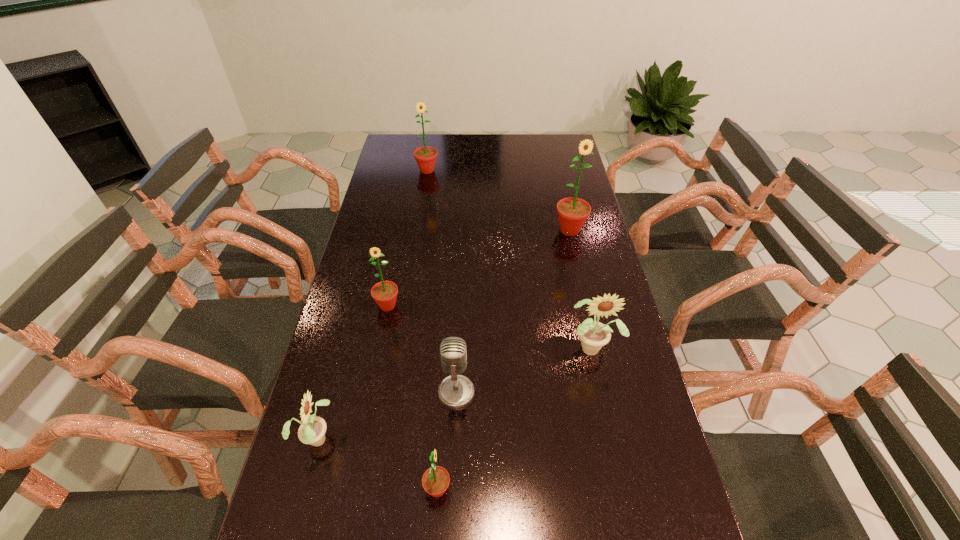
This screenshot has width=960, height=540. What are the coordinates of `vacant region located 0.090m on the face of the nearest sunflower` in the screenshot? It's located at [x=492, y=489].

Locate an element on the screen. Image resolution: width=960 pixels, height=540 pixels. vacant position at the far edge of the desktop is located at coordinates (497, 134).

Locate an element on the screen. The width and height of the screenshot is (960, 540). blank space at the left edge is located at coordinates (365, 291).

The image size is (960, 540). In order to click on vacant space at the far left corner of the desktop in this screenshot , I will do `click(390, 148)`.

Locate an element on the screen. Image resolution: width=960 pixels, height=540 pixels. free point between the biggest green sunflower and the gray microphone is located at coordinates 513,311.

Where is `vacant region between the third biggest green sunflower and the second nearest sunflower`? This screenshot has width=960, height=540. vacant region between the third biggest green sunflower and the second nearest sunflower is located at coordinates (352, 372).

The height and width of the screenshot is (540, 960). What are the coordinates of `vacant space that's between the third farthest object and the third smallest green sunflower` in the screenshot? It's located at (407, 238).

At what (x,y) coordinates should I click in order to perform the action: click on empty space that is in between the farthest sunflower and the second farthest object. Please return your answer as a coordinate pair (x, y). This screenshot has height=540, width=960. Looking at the image, I should click on (498, 200).

You are a GUI agent. You are given a task and a screenshot of the screen. Output one action in this format:
    pyautogui.click(x=<x>, y=<y>)
    Task: Click on the empty space between the biggest green sunflower and the third nearest sunflower
    The width and height of the screenshot is (960, 540).
    Given the screenshot: What is the action you would take?
    pyautogui.click(x=582, y=288)

I want to click on vacant area that lies between the fourth nearest sunflower and the farthest object, so click(x=407, y=238).